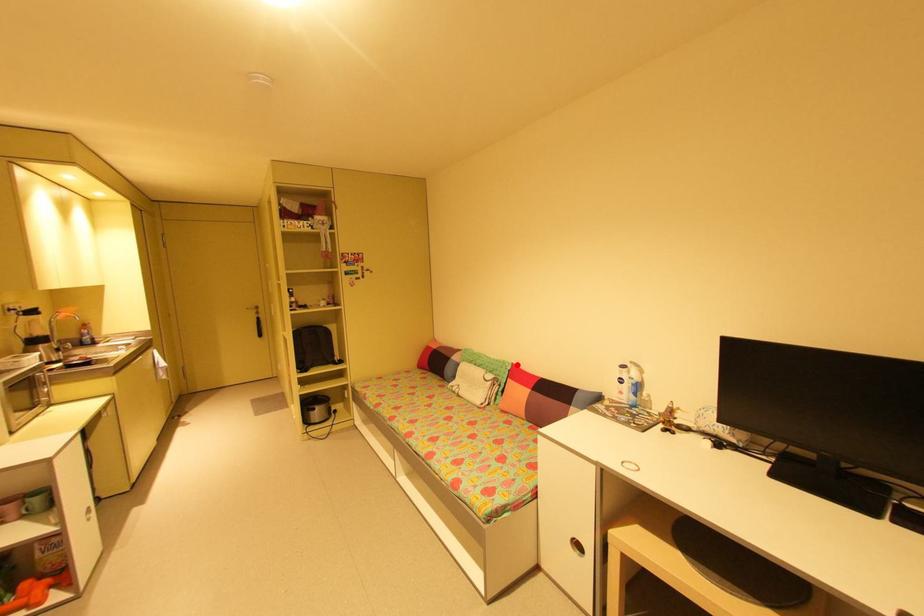
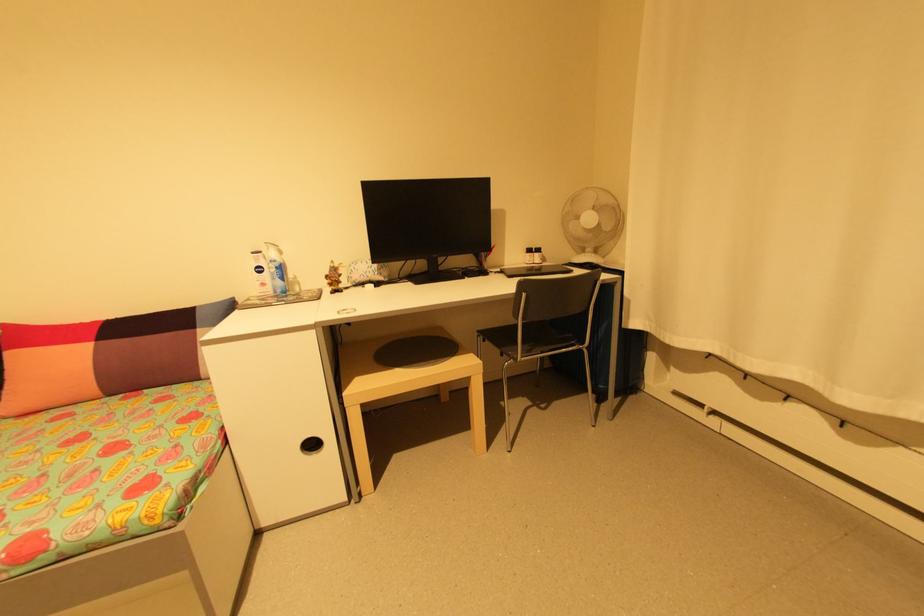
In the second image, find the point that corresponds to the highlighted location in the first image.

(8, 326)